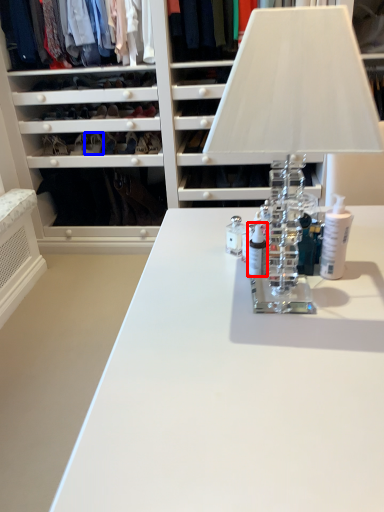
Question: Which point is further to the camera, toiletry (highlighted by a red box) or shoe (highlighted by a blue box)?

Choices:
 (A) toiletry
 (B) shoe

Answer: (B)